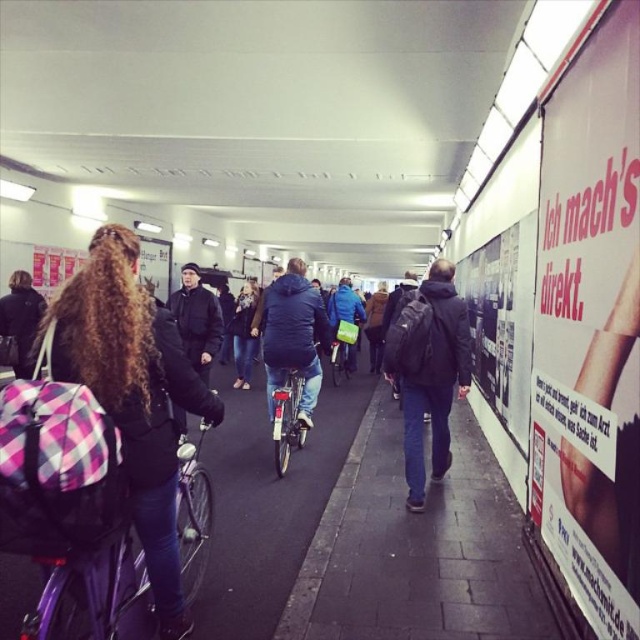
Who is taller, matte black backpack at center or dark blue jacket at center?

With more height is matte black backpack at center.

Is matte black backpack at center positioned before dark blue jacket at center?

Yes, it is in front of dark blue jacket at center.

Which is behind, point (392, 372) or point (289, 301)?

The point (289, 301) is behind.

Locate an element on the screen. The image size is (640, 640). matte black backpack at center is located at coordinates (428, 371).

Can you confirm if white paper advertisement at right is wider than metallic silver bicycle at center?

In fact, white paper advertisement at right might be narrower than metallic silver bicycle at center.

Between white paper advertisement at right and metallic silver bicycle at center, which one is positioned lower?

metallic silver bicycle at center is below.

Locate an element on the screen. Image resolution: width=640 pixels, height=640 pixels. white paper advertisement at right is located at coordinates (589, 326).

Can you confirm if purple matte bicycle at left is taller than metallic silver bicycle at center?

In fact, purple matte bicycle at left may be shorter than metallic silver bicycle at center.

Who is taller, purple matte bicycle at left or metallic silver bicycle at center?

metallic silver bicycle at center

Locate an element on the screen. purple matte bicycle at left is located at coordinates (93, 595).